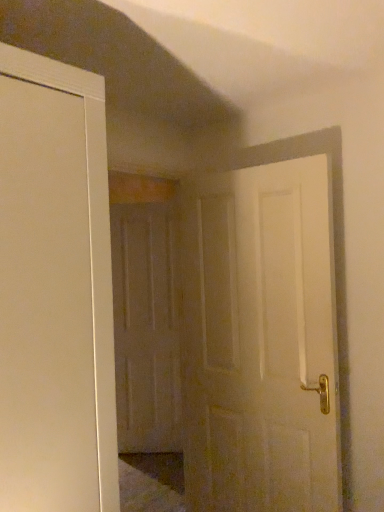
Question: Considering the positions of point (188, 459) and point (172, 423), is point (188, 459) closer or farther from the camera than point (172, 423)?

Choices:
 (A) closer
 (B) farther

Answer: (A)

Question: From a real-world perspective, is white matte door at center, positioned as the 2th door in back-to-front order, above or below matte wooden door at center, placed as the 1th door when sorted from left to right?

Choices:
 (A) below
 (B) above

Answer: (B)

Question: Considering the relative positions of white matte door at center, placed as the 2th door when sorted from left to right, and matte wooden door at center, which is counted as the 1th door, starting from the back, in the image provided, is white matte door at center, placed as the 2th door when sorted from left to right, to the left or to the right of matte wooden door at center, which is counted as the 1th door, starting from the back,?

Choices:
 (A) right
 (B) left

Answer: (A)

Question: From a real-world perspective, is matte wooden door at center, which is counted as the 1th door, starting from the back, positioned above or below white matte door at center, positioned as the 2th door in back-to-front order?

Choices:
 (A) below
 (B) above

Answer: (A)

Question: Visually, is matte wooden door at center, which is the second door from right to left, positioned to the left or to the right of white matte door at center, placed as the 2th door when sorted from left to right?

Choices:
 (A) right
 (B) left

Answer: (B)

Question: Relative to white matte door at center, placed as the 2th door when sorted from left to right, is matte wooden door at center, acting as the 2th door starting from the front, in front or behind?

Choices:
 (A) behind
 (B) front

Answer: (A)

Question: In terms of size, does matte wooden door at center, which is counted as the 1th door, starting from the back, appear bigger or smaller than white matte door at center, placed as the 2th door when sorted from left to right?

Choices:
 (A) small
 (B) big

Answer: (A)